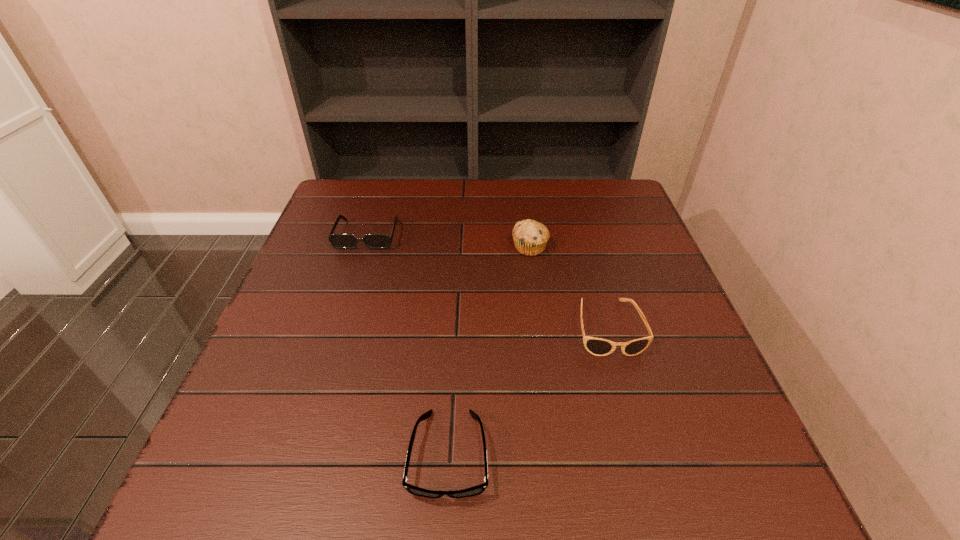
The height and width of the screenshot is (540, 960). Find the location of `vacant space in between the third object from right to left and the second object from right to left`. vacant space in between the third object from right to left and the second object from right to left is located at coordinates (490, 350).

Identify which object is located as the nearest to the rightmost object. Please provide its 2D coordinates. Your answer should be formatted as a tuple, i.e. [(x, y)], where the tuple contains the x and y coordinates of a point satisfying the conditions above.

[(530, 237)]

Find the location of a particular element. the closest object to the second nearest sunglasses is located at coordinates click(530, 237).

Select which sunglasses appears as the closest to the second sunglasses from left to right. Please provide its 2D coordinates. Your answer should be formatted as a tuple, i.e. [(x, y)], where the tuple contains the x and y coordinates of a point satisfying the conditions above.

[(597, 346)]

Identify which sunglasses is the nearest to the tallest object. Please provide its 2D coordinates. Your answer should be formatted as a tuple, i.e. [(x, y)], where the tuple contains the x and y coordinates of a point satisfying the conditions above.

[(597, 346)]

Where is `vacant region that satisfies the following two spatial constraints: 1. on the front-facing side of the leftmost object; 2. on the right side of the tallest object`? The width and height of the screenshot is (960, 540). vacant region that satisfies the following two spatial constraints: 1. on the front-facing side of the leftmost object; 2. on the right side of the tallest object is located at coordinates (364, 247).

The width and height of the screenshot is (960, 540). In order to click on free space that satisfies the following two spatial constraints: 1. on the front-facing side of the second object from right to left; 2. on the right side of the leftmost sunglasses in this screenshot , I will do `click(364, 247)`.